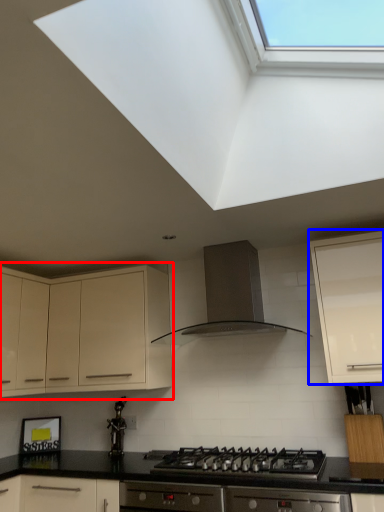
Question: Which point is further to the camera, cabinetry (highlighted by a red box) or cabinetry (highlighted by a blue box)?

Choices:
 (A) cabinetry
 (B) cabinetry

Answer: (A)